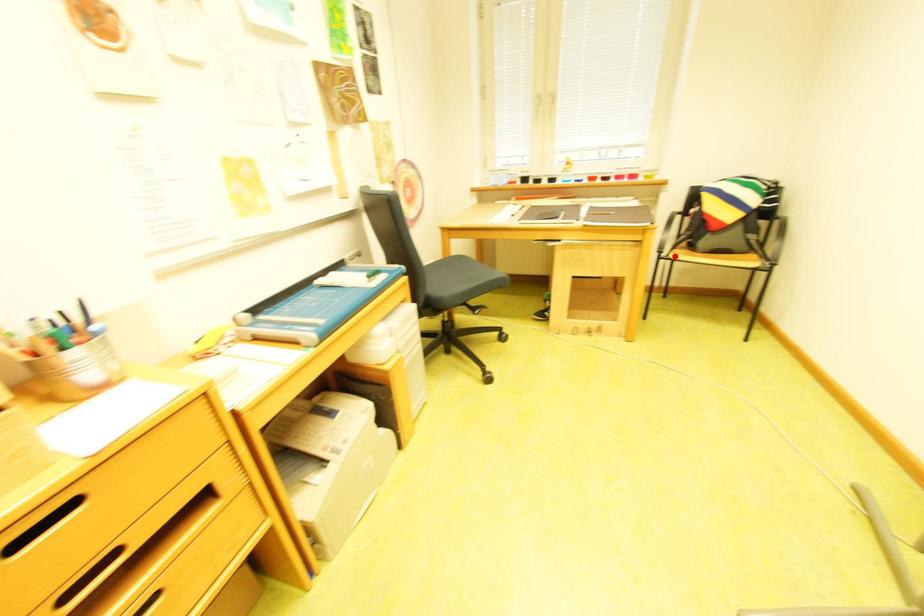
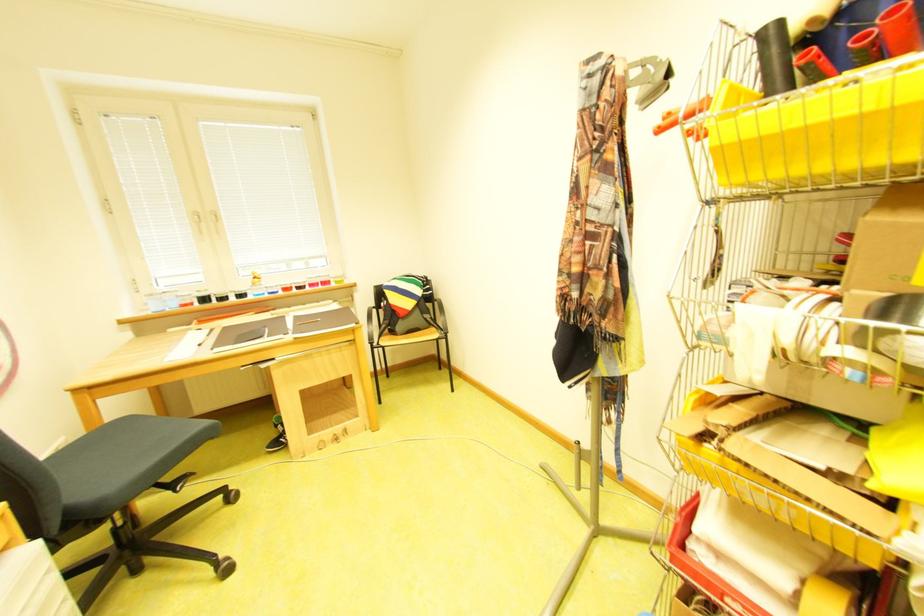
In the second image, find the point that corresponds to the highlighted location in the first image.

(385, 345)